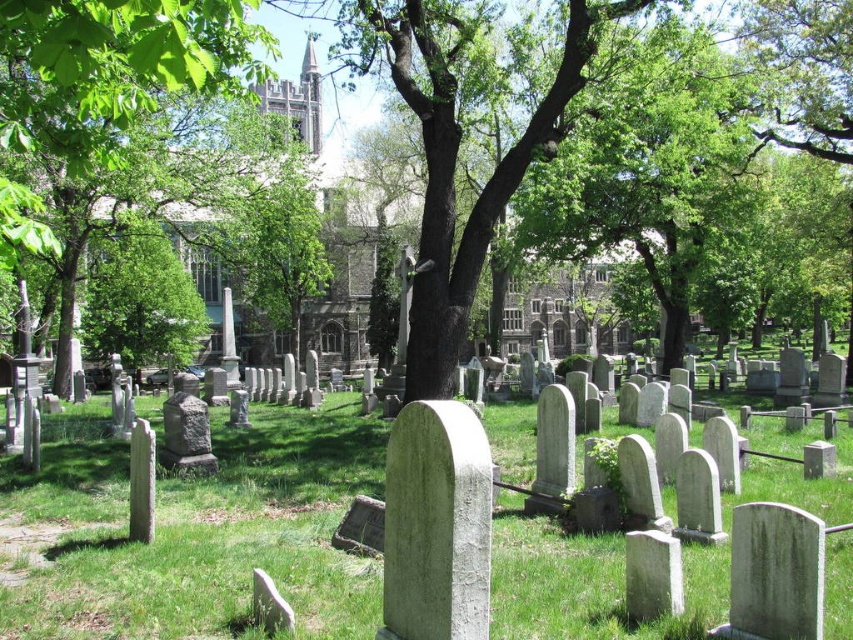
Does green grassy at center have a greater height compared to green leafy tree at center?

No, green grassy at center is not taller than green leafy tree at center.

Which of these two, green grassy at center or green leafy tree at center, stands taller?

Standing taller between the two is green leafy tree at center.

Image resolution: width=853 pixels, height=640 pixels. What do you see at coordinates (204, 532) in the screenshot?
I see `green grassy at center` at bounding box center [204, 532].

This screenshot has height=640, width=853. In order to click on green grassy at center in this screenshot , I will do `click(204, 532)`.